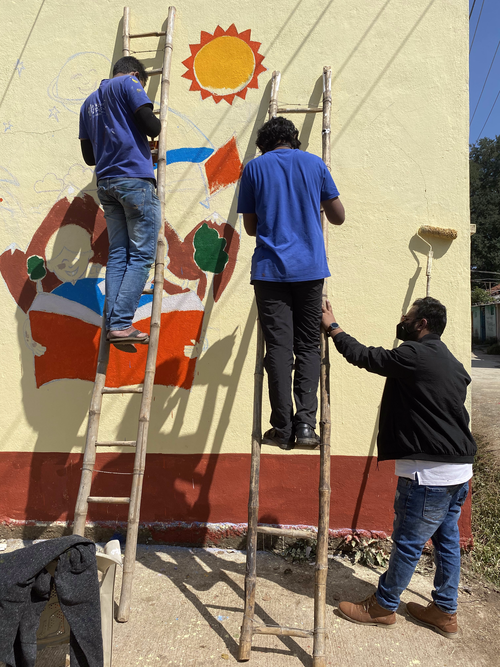
Where is `wooden ladders`? wooden ladders is located at coordinates (89, 445), (254, 479).